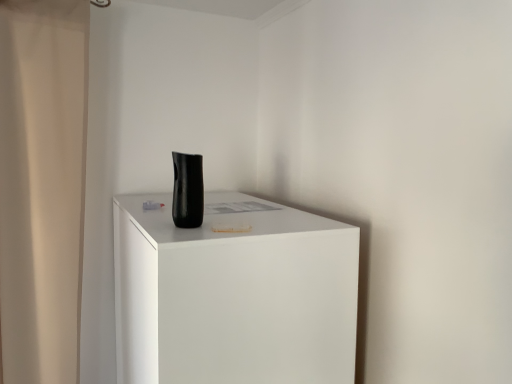
Image resolution: width=512 pixels, height=384 pixels. What do you see at coordinates (41, 187) in the screenshot?
I see `beige fabric shower curtain at left` at bounding box center [41, 187].

Where is `black matte vase at center`? This screenshot has width=512, height=384. black matte vase at center is located at coordinates (188, 190).

From the image's perspective, is beige fabric shower curtain at left positioned above or below matte black vase at center?

Clearly, from the image's perspective, beige fabric shower curtain at left is above matte black vase at center.

From a real-world perspective, between beige fabric shower curtain at left and matte black vase at center, who is vertically lower?

matte black vase at center.

Is beige fabric shower curtain at left oriented towards matte black vase at center?

No, beige fabric shower curtain at left is not turned towards matte black vase at center.

In the scene shown: Is black matte vase at center to the right of beige fabric shower curtain at left from the viewer's perspective?

Yes, black matte vase at center is to the right of beige fabric shower curtain at left.

Is point (197, 172) closer or farther from the camera than point (78, 347)?

Point (197, 172) appears to be closer to the viewer than point (78, 347).

Is beige fabric shower curtain at left a part of black matte vase at center?

Definitely not — beige fabric shower curtain at left is not inside black matte vase at center.

Are black matte vase at center and beige fabric shower curtain at left beside each other?

black matte vase at center and beige fabric shower curtain at left are clearly separated.

From a real-world perspective, is matte black vase at center physically above black matte vase at center?

Incorrect, from a real-world perspective, matte black vase at center is lower than black matte vase at center.

Is point (288, 215) closer to viewer compared to point (174, 219)?

No, it is behind (174, 219).

Does matte black vase at center come behind black matte vase at center?

No.

Can we say matte black vase at center lies outside black matte vase at center?

That's correct, matte black vase at center is outside of black matte vase at center.

From the picture: Considering the relative sizes of black matte vase at center and matte black vase at center in the image provided, is black matte vase at center taller than matte black vase at center?

No.

Between black matte vase at center and matte black vase at center, which one has larger size?

matte black vase at center is bigger.

Looking at their sizes, would you say black matte vase at center is wider or thinner than matte black vase at center?

In the image, black matte vase at center appears to be more narrow than matte black vase at center.

Would you say matte black vase at center contains beige fabric shower curtain at left?

Actually, beige fabric shower curtain at left is outside matte black vase at center.

In the scene shown: Is matte black vase at center next to beige fabric shower curtain at left?

No, matte black vase at center is not making contact with beige fabric shower curtain at left.

In terms of width, does matte black vase at center look wider or thinner when compared to beige fabric shower curtain at left?

Considering their sizes, matte black vase at center looks broader than beige fabric shower curtain at left.

Which object is wider, beige fabric shower curtain at left or black matte vase at center?

beige fabric shower curtain at left.

How distant is beige fabric shower curtain at left from black matte vase at center?

25.94 inches.

Considering the relative sizes of beige fabric shower curtain at left and black matte vase at center in the image provided, is beige fabric shower curtain at left taller than black matte vase at center?

Correct, beige fabric shower curtain at left is much taller as black matte vase at center.

From the image's perspective, is beige fabric shower curtain at left over black matte vase at center?

Actually, beige fabric shower curtain at left appears below black matte vase at center in the image.

At what (x,y) coordinates should I click in order to perform the action: click on furniture below the beige fabric shower curtain at left (from a real-world perspective). Please return your answer as a coordinate pair (x, y). Looking at the image, I should click on (234, 294).

You are a GUI agent. You are given a task and a screenshot of the screen. Output one action in this format:
    pyautogui.click(x=<x>, y=<y>)
    Task: Click on the vase located above the beige fabric shower curtain at left (from the image's perspective)
    
    Given the screenshot: What is the action you would take?
    pyautogui.click(x=188, y=190)

Looking at the image, which one is located closer to black matte vase at center, matte black vase at center or beige fabric shower curtain at left?

matte black vase at center lies closer to black matte vase at center than the other object.

When comparing their distances from beige fabric shower curtain at left, does black matte vase at center or matte black vase at center seem further?

black matte vase at center.

Based on their spatial positions, is black matte vase at center or beige fabric shower curtain at left closer to matte black vase at center?

Among the two, black matte vase at center is located nearer to matte black vase at center.

Consider the image. When comparing their distances from beige fabric shower curtain at left, does matte black vase at center or black matte vase at center seem closer?

matte black vase at center is closer to beige fabric shower curtain at left.

Based on their spatial positions, is beige fabric shower curtain at left or matte black vase at center closer to black matte vase at center?

matte black vase at center lies closer to black matte vase at center than the other object.

Considering their positions, is beige fabric shower curtain at left positioned closer to matte black vase at center than black matte vase at center?

black matte vase at center lies closer to matte black vase at center than the other object.

This screenshot has width=512, height=384. Identify the location of vase located between beige fabric shower curtain at left and matte black vase at center in the left-right direction. (188, 190).